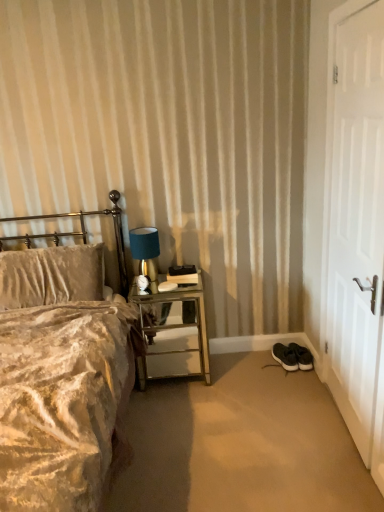
Where is `vacant area that is in front of mirrored glass nightstand at center`? Image resolution: width=384 pixels, height=512 pixels. vacant area that is in front of mirrored glass nightstand at center is located at coordinates (183, 411).